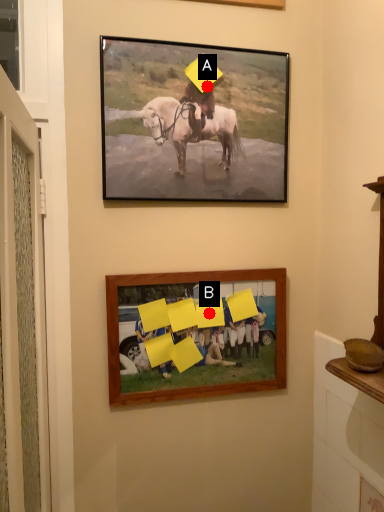
Question: Two points are circled on the image, labeled by A and B beside each circle. Which of the following is the farthest from the observer?

Choices:
 (A) A is further
 (B) B is further

Answer: (B)